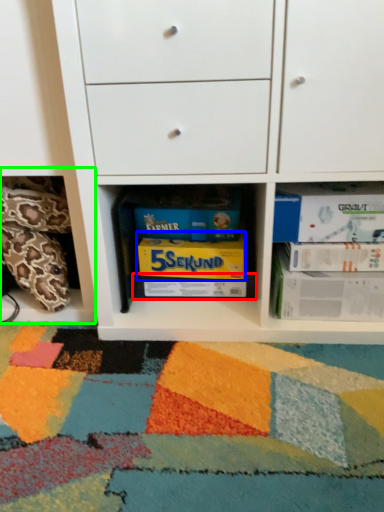
Question: Estimate the real-world distances between objects in this image. Which object is farther from paperback book (highlighted by a red box), paperback book (highlighted by a blue box) or shelf (highlighted by a green box)?

Choices:
 (A) paperback book
 (B) shelf

Answer: (B)